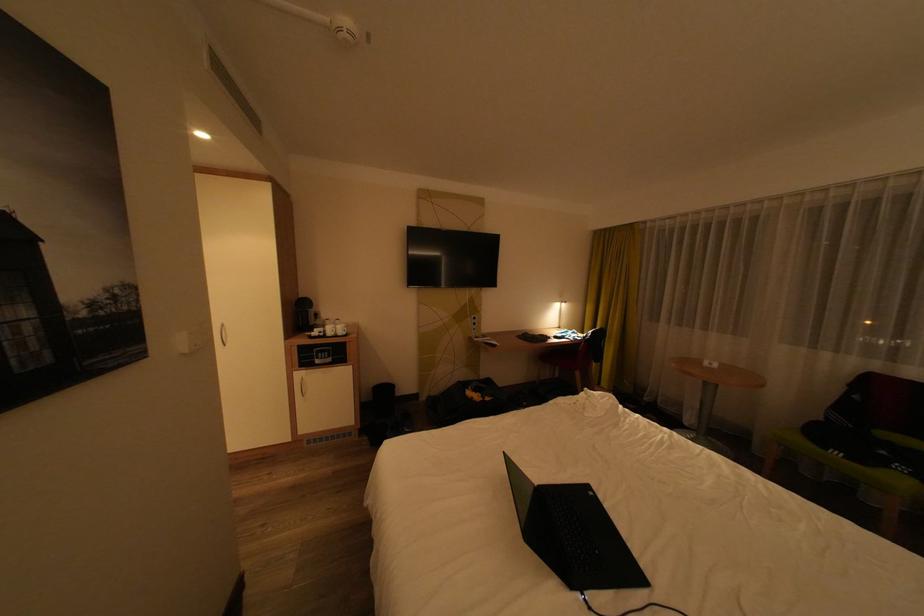
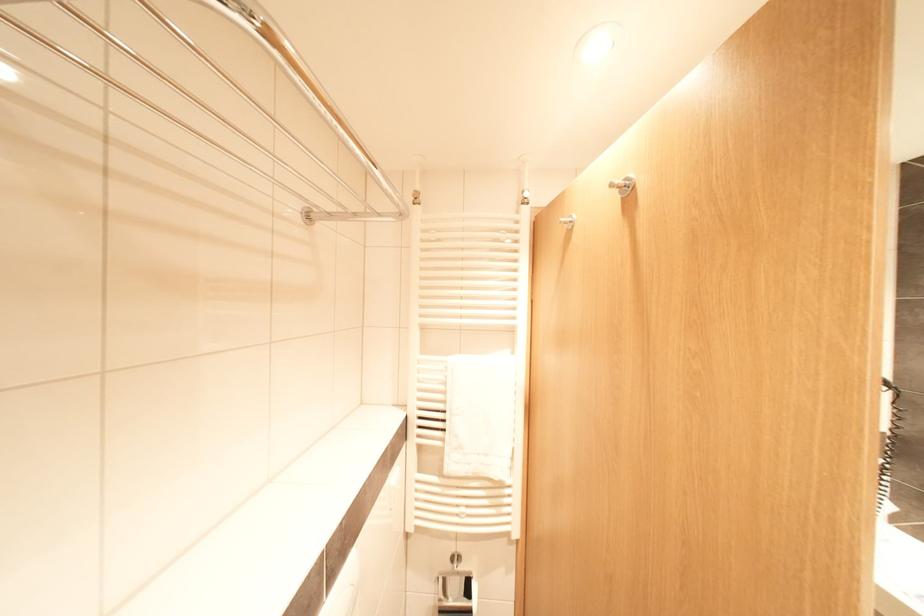
Question: The images are taken continuously from a first-person perspective. In which direction are you moving?

Choices:
 (A) Left
 (B) Right
 (C) Forward
 (D) Backward

Answer: (A)